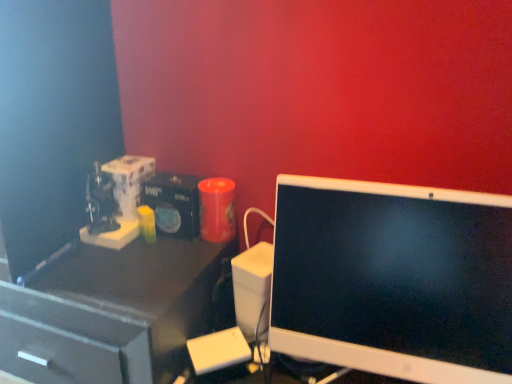
Question: From a real-world perspective, is matte black desk at left positioned over white glossy computer monitor at right based on gravity?

Choices:
 (A) yes
 (B) no

Answer: (B)

Question: Is matte black desk at left positioned before white glossy computer monitor at right?

Choices:
 (A) no
 (B) yes

Answer: (A)

Question: Is matte black desk at left oriented towards white glossy computer monitor at right?

Choices:
 (A) no
 (B) yes

Answer: (A)

Question: Does matte black desk at left appear on the left side of white glossy computer monitor at right?

Choices:
 (A) no
 (B) yes

Answer: (B)

Question: Does matte black desk at left contain white glossy computer monitor at right?

Choices:
 (A) no
 (B) yes

Answer: (A)

Question: Is matte black desk at left touching white glossy computer monitor at right?

Choices:
 (A) no
 (B) yes

Answer: (A)

Question: Is white glossy computer monitor at right smaller than matte black desk at left?

Choices:
 (A) no
 (B) yes

Answer: (B)

Question: From the image's perspective, is white glossy computer monitor at right below matte black desk at left?

Choices:
 (A) yes
 (B) no

Answer: (B)

Question: Is white glossy computer monitor at right bigger than matte black desk at left?

Choices:
 (A) yes
 (B) no

Answer: (B)

Question: Could you tell me if white glossy computer monitor at right is facing matte black desk at left?

Choices:
 (A) yes
 (B) no

Answer: (B)

Question: Is matte black desk at left at the back of white glossy computer monitor at right?

Choices:
 (A) yes
 (B) no

Answer: (B)

Question: Can you confirm if white glossy computer monitor at right is positioned to the right of matte black desk at left?

Choices:
 (A) no
 (B) yes

Answer: (B)

Question: Is matte black desk at left wider or thinner than white glossy computer monitor at right?

Choices:
 (A) thin
 (B) wide

Answer: (B)